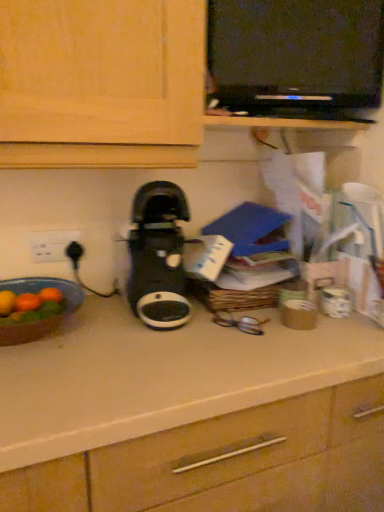
What do you see at coordinates (51, 245) in the screenshot?
I see `white plastic electric outlet at left` at bounding box center [51, 245].

The width and height of the screenshot is (384, 512). Identify the location of matte brown bowl at left. (40, 320).

This screenshot has width=384, height=512. What do you see at coordinates (295, 57) in the screenshot?
I see `black plastic dvd player at upper center` at bounding box center [295, 57].

What is the approximate width of black plastic coffee maker at center?

It is 33.20 centimeters.

What are the coordinates of `white plastic electric outlet at left` in the screenshot? It's located at (51, 245).

Is white plastic electric outlet at left aimed at black plastic dvd player at upper center?

No, white plastic electric outlet at left does not turn towards black plastic dvd player at upper center.

Does point (51, 232) come farther from viewer compared to point (268, 88)?

That is True.

From a real-world perspective, is white plastic electric outlet at left physically above black plastic dvd player at upper center?

Incorrect, from a real-world perspective, white plastic electric outlet at left is lower than black plastic dvd player at upper center.

Locate an element on the screen. appliance above the white plastic electric outlet at left (from a real-world perspective) is located at coordinates (295, 57).

Considering the sizes of objects black plastic coffee maker at center and matte brown bowl at left in the image provided, who is taller, black plastic coffee maker at center or matte brown bowl at left?

black plastic coffee maker at center is taller.

Considering the positions of objects black plastic coffee maker at center and matte brown bowl at left in the image provided, who is more to the right, black plastic coffee maker at center or matte brown bowl at left?

black plastic coffee maker at center is more to the right.

Where is `home appliance that appears on the right of matte brown bowl at left`? The width and height of the screenshot is (384, 512). home appliance that appears on the right of matte brown bowl at left is located at coordinates (158, 256).

How far apart are black plastic coffee maker at center and matte brown bowl at left?

They are 8.80 inches apart.

Who is taller, white plastic electric outlet at left or black plastic coffee maker at center?

black plastic coffee maker at center.

From a real-world perspective, between white plastic electric outlet at left and black plastic coffee maker at center, who is vertically lower?

Result: white plastic electric outlet at left, from a real-world perspective.

Can you confirm if white plastic electric outlet at left is thinner than black plastic coffee maker at center?

Correct, the width of white plastic electric outlet at left is less than that of black plastic coffee maker at center.

Would you say black plastic dvd player at upper center contains white plastic electric outlet at left?

Definitely not — white plastic electric outlet at left is not inside black plastic dvd player at upper center.

Considering the positions of objects black plastic dvd player at upper center and white plastic electric outlet at left in the image provided, who is in front, black plastic dvd player at upper center or white plastic electric outlet at left?

black plastic dvd player at upper center is in front.

From a real-world perspective, which is physically above, black plastic dvd player at upper center or white plastic electric outlet at left?

From a 3D spatial view, black plastic dvd player at upper center is above.

Considering the points (270, 66) and (62, 257), which point is in front, point (270, 66) or point (62, 257)?

The point (270, 66) is more forward.

Is point (354, 41) closer or farther from the camera than point (136, 199)?

Point (354, 41) appears to be closer to the viewer than point (136, 199).

Is black plastic dvd player at upper center inside or outside of black plastic coffee maker at center?

black plastic dvd player at upper center is spatially situated outside black plastic coffee maker at center.

Is black plastic dvd player at upper center facing towards black plastic coffee maker at center?

No, black plastic dvd player at upper center is not aimed at black plastic coffee maker at center.

Is black plastic dvd player at upper center next to black plastic coffee maker at center?

black plastic dvd player at upper center is not next to black plastic coffee maker at center, and they're not touching.

From a real-world perspective, who is located higher, matte brown bowl at left or black plastic dvd player at upper center?

black plastic dvd player at upper center.

Considering the relative sizes of matte brown bowl at left and black plastic dvd player at upper center in the image provided, is matte brown bowl at left smaller than black plastic dvd player at upper center?

Yes, matte brown bowl at left is smaller than black plastic dvd player at upper center.

At what (x,y) coordinates should I click in order to perform the action: click on kitchen appliance below the black plastic dvd player at upper center (from a real-world perspective). Please return your answer as a coordinate pair (x, y). The width and height of the screenshot is (384, 512). Looking at the image, I should click on (40, 320).

Is matte brown bowl at left further to camera compared to black plastic dvd player at upper center?

No, matte brown bowl at left is closer to the viewer.

From the image's perspective, is matte brown bowl at left beneath white plastic electric outlet at left?

Yes, from the image's perspective, matte brown bowl at left is beneath white plastic electric outlet at left.

Choose the correct answer: Is matte brown bowl at left inside white plastic electric outlet at left or outside it?

matte brown bowl at left is outside white plastic electric outlet at left.

Considering the sizes of matte brown bowl at left and white plastic electric outlet at left in the image, is matte brown bowl at left taller or shorter than white plastic electric outlet at left?

matte brown bowl at left is taller than white plastic electric outlet at left.

Is matte brown bowl at left next to white plastic electric outlet at left?

No, matte brown bowl at left is not with white plastic electric outlet at left.

In order to click on appliance above the white plastic electric outlet at left (from a real-world perspective) in this screenshot , I will do coord(295,57).

Where is `kitchen appliance in front of the black plastic coffee maker at center`? Image resolution: width=384 pixels, height=512 pixels. kitchen appliance in front of the black plastic coffee maker at center is located at coordinates (40, 320).

Estimate the real-world distances between objects in this image. Which object is further from black plastic coffee maker at center, matte brown bowl at left or white plastic electric outlet at left?

white plastic electric outlet at left is further to black plastic coffee maker at center.

When comparing their distances from black plastic coffee maker at center, does black plastic dvd player at upper center or matte brown bowl at left seem further?

Among the two, black plastic dvd player at upper center is located further to black plastic coffee maker at center.

Looking at the image, which one is located further to white plastic electric outlet at left, black plastic dvd player at upper center or black plastic coffee maker at center?

black plastic dvd player at upper center.

From the image, which object appears to be nearer to black plastic dvd player at upper center, black plastic coffee maker at center or white plastic electric outlet at left?

black plastic coffee maker at center is positioned closer to the anchor black plastic dvd player at upper center.

Estimate the real-world distances between objects in this image. Which object is further from matte brown bowl at left, white plastic electric outlet at left or black plastic coffee maker at center?

The object further to matte brown bowl at left is black plastic coffee maker at center.

Estimate the real-world distances between objects in this image. Which object is closer to matte brown bowl at left, white plastic electric outlet at left or black plastic dvd player at upper center?

white plastic electric outlet at left is positioned closer to the anchor matte brown bowl at left.

Which object lies further to the anchor point black plastic coffee maker at center, white plastic electric outlet at left or black plastic dvd player at upper center?

black plastic dvd player at upper center lies further to black plastic coffee maker at center than the other object.

From the image, which object appears to be nearer to black plastic coffee maker at center, matte brown bowl at left or black plastic dvd player at upper center?

matte brown bowl at left.

Locate an element on the screen. kitchen appliance between white plastic electric outlet at left and black plastic dvd player at upper center in the horizontal direction is located at coordinates (40, 320).

This screenshot has height=512, width=384. What are the coordinates of `home appliance between black plastic dvd player at upper center and matte brown bowl at left in the up-down direction` in the screenshot? It's located at (158, 256).

Where is `home appliance between matte brown bowl at left and white plastic electric outlet at left in the front-back direction`? This screenshot has height=512, width=384. home appliance between matte brown bowl at left and white plastic electric outlet at left in the front-back direction is located at coordinates (158, 256).

Where is `home appliance between white plastic electric outlet at left and black plastic dvd player at upper center`? home appliance between white plastic electric outlet at left and black plastic dvd player at upper center is located at coordinates (158, 256).